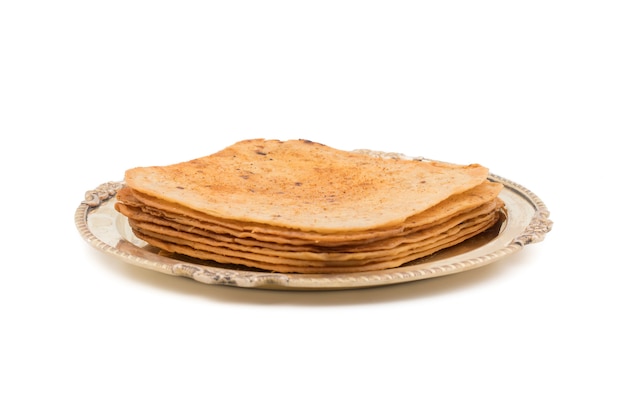
Identify the location of decorative element on serving platter rim. This screenshot has height=397, width=626. (105, 190), (225, 277), (380, 152), (546, 224).